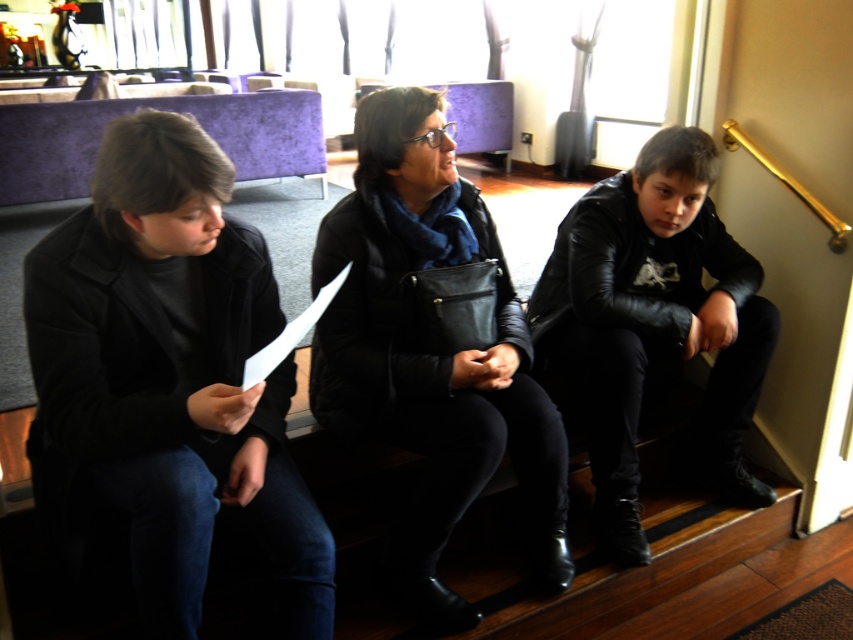
You are an interior designer assessing the seating arrangement of the three people on the staircase. You need to ensure that each person has enough legroom. The black matte jacket at center is taller than the black leather jacket at right. Considering their heights, which jacketed individual might require more legroom?

The black matte jacket at center has a greater height compared to the black leather jacket at right, so the individual wearing the black matte jacket at center would likely require more legroom due to their taller stature.